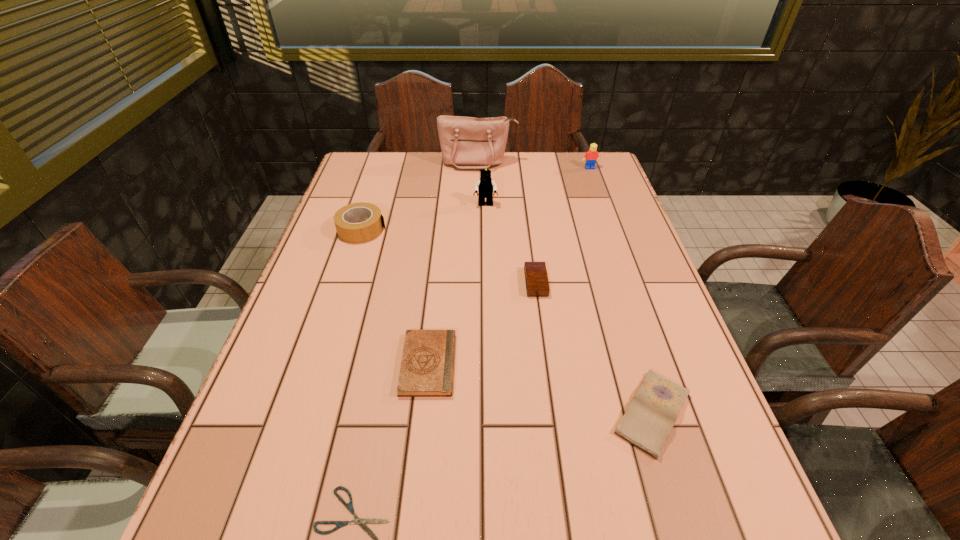
Locate an element on the screen. This screenshot has height=540, width=960. shoulder bag is located at coordinates (466, 142).

Image resolution: width=960 pixels, height=540 pixels. In order to click on the nearer Lego in this screenshot , I will do `click(485, 186)`.

Where is `the sixth nearest object`? Image resolution: width=960 pixels, height=540 pixels. the sixth nearest object is located at coordinates (485, 186).

Locate an element on the screen. the third tallest object is located at coordinates (591, 156).

The height and width of the screenshot is (540, 960). In order to click on the right Lego in this screenshot , I will do `click(591, 156)`.

You are a GUI agent. You are given a task and a screenshot of the screen. Output one action in this format:
    pyautogui.click(x=<x>, y=<y>)
    Task: Click on the duct tape
    The height and width of the screenshot is (540, 960).
    Given the screenshot: What is the action you would take?
    (345, 219)

Find the location of a particular element. This screenshot has height=540, width=960. the fourth tallest object is located at coordinates [345, 219].

At what (x,y) coordinates should I click in order to perform the action: click on the fourth nearest object. Please return your answer as a coordinate pair (x, y). Image resolution: width=960 pixels, height=540 pixels. Looking at the image, I should click on (536, 279).

This screenshot has height=540, width=960. What are the coordinates of `the fourth shortest object` in the screenshot? It's located at (536, 279).

You are a GUI agent. You are given a task and a screenshot of the screen. Output one action in this format:
    pyautogui.click(x=<x>, y=<y>)
    Task: Click on the right diary
    The width and height of the screenshot is (960, 540).
    Given the screenshot: What is the action you would take?
    pyautogui.click(x=651, y=415)